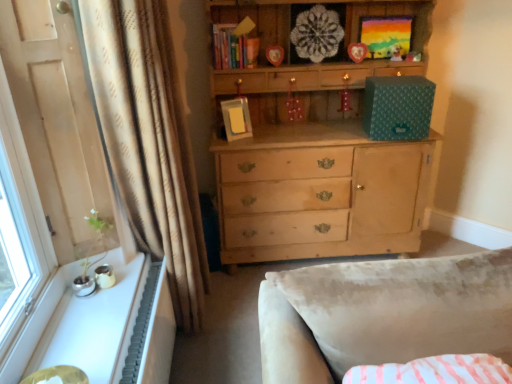
You are a GUI agent. You are given a task and a screenshot of the screen. Output one action in this format:
    pyautogui.click(x=<x>, y=<y>)
    Task: Click on the vacant space situated above white glossy windowsill at lower left (from a real-world perspective)
    This screenshot has width=512, height=384.
    Given the screenshot: What is the action you would take?
    pyautogui.click(x=84, y=314)